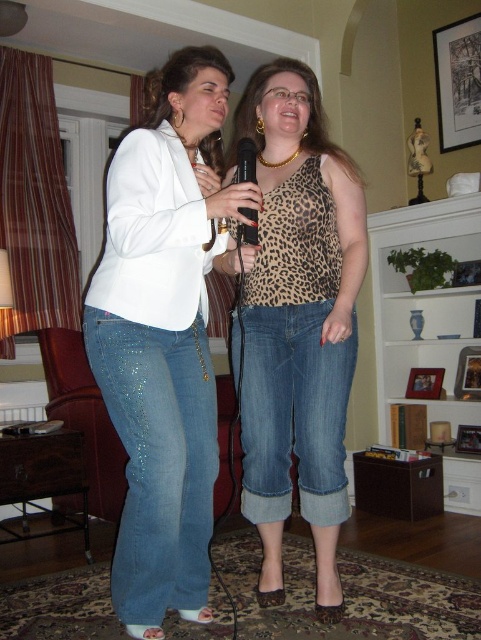
From the picture: You are organizing a small event and need to place the matte white blazer at center and the black plastic microphone at center on a shelf. If the shelf can only hold items up to the size of the microphone, will both items fit?

The matte white blazer at center is larger in size than the black plastic microphone at center, so the blazer will not fit on the shelf if it can only accommodate items up to the microphone size.

You are a photographer setting up for a photoshoot in the living room. You need to position a spotlight so it illuminates both the matte white blazer at center and the black plastic microphone at center. Since the spotlight can only be angled downward from above, which object should you aim the spotlight at first to ensure both are lit properly?

The spotlight should be aimed at the matte white blazer at center first because it is taller than the black plastic microphone at center. By angling the light downward from above the taller object, the light will naturally cover both objects, ensuring proper illumination.

You are a photographer setting up for a group photo in the living room. You need to position the leopard print tank top at center and the black plastic microphone at center so that they are aligned properly. According to the scene, which object should be placed to the left to ensure correct alignment?

The black plastic microphone at center should be placed to the left of the leopard print tank top at center because the leopard print tank top at center is positioned on the right side of the black plastic microphone at center.